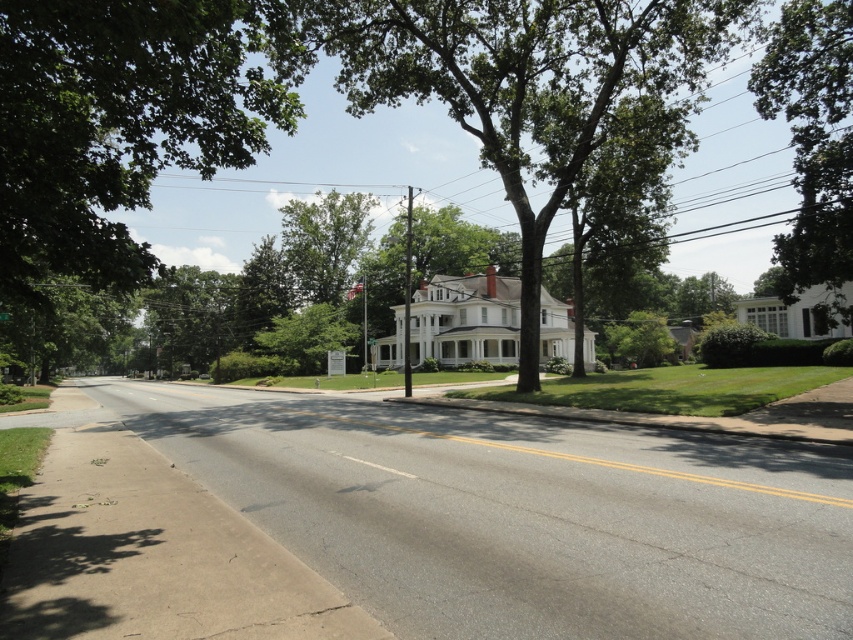
You are standing on the sidewalk on the right side of the road and want to walk towards the house in the background. Which direction should you walk to stay between the green leafy tree at center and the green leafy tree at upper right?

You should walk towards the left to stay between the green leafy tree at center and the green leafy tree at upper right because the green leafy tree at center is to the left of the green leafy tree at upper right.

You are a bird looking for a place to perch. You see the green leafy tree at center and the green leafy tree at upper right. Which tree is positioned higher in the sky?

The green leafy tree at center is positioned higher in the sky than the green leafy tree at upper right.

You are a bird looking for a nesting spot. You see the green leafy tree at center and the green leafy tree at upper right. Which tree would be better for nesting if you prefer taller trees?

The green leafy tree at center is much taller than the green leafy tree at upper right, so it would be better for nesting if you prefer taller trees.